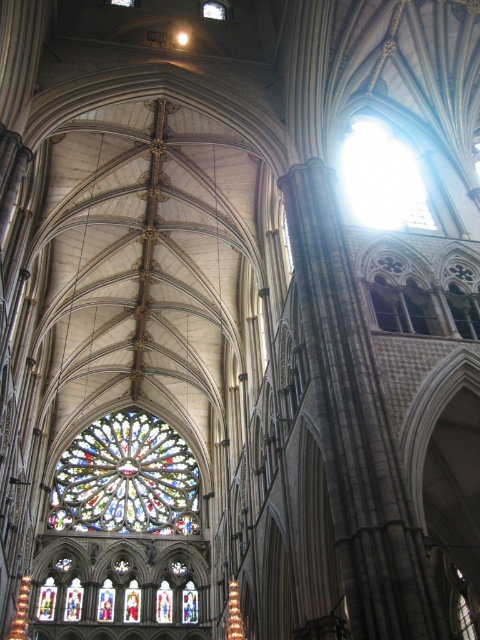
Looking at this image, you are standing in the cathedral and want to move from the point at coordinates point (92, 433) to the point at coordinates point (423, 205). Can you walk directly between them without any obstacles?

Point (92, 433) is behind point (423, 205), so you cannot walk directly between them without going around the obstacle in front.

You are an architect analyzing the cathedral design. You notice the multicolored stained glass at center and the transparent glass at upper center. Which one has a larger surface area?

The multicolored stained glass at center has a larger surface area than the transparent glass at upper center, as stated in the description.

You are an architect analyzing the cathedral design. You notice the multicolored stained glass at center and the transparent glass at upper center. Which of these two glasses is positioned higher in the cathedral?

The transparent glass at upper center is positioned higher than the multicolored stained glass at center.